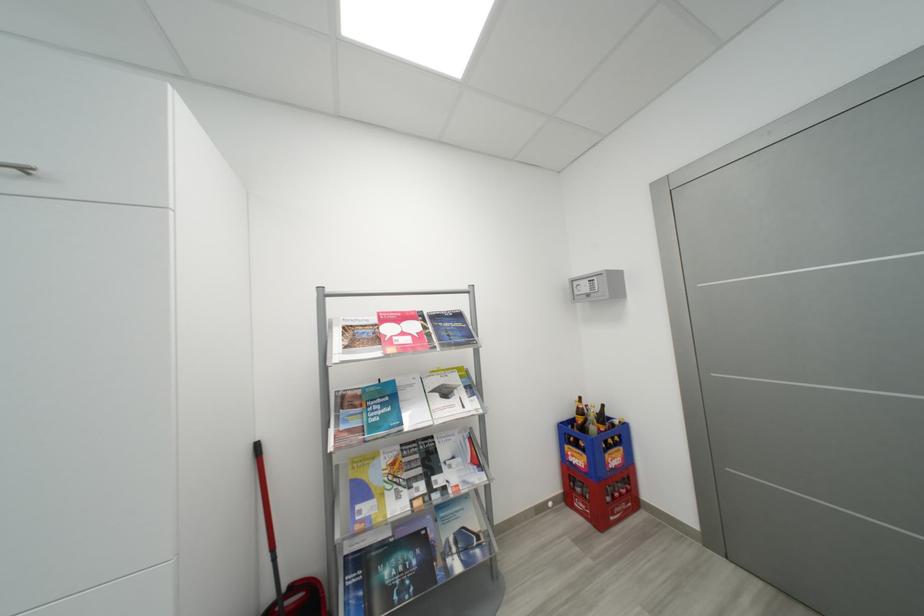
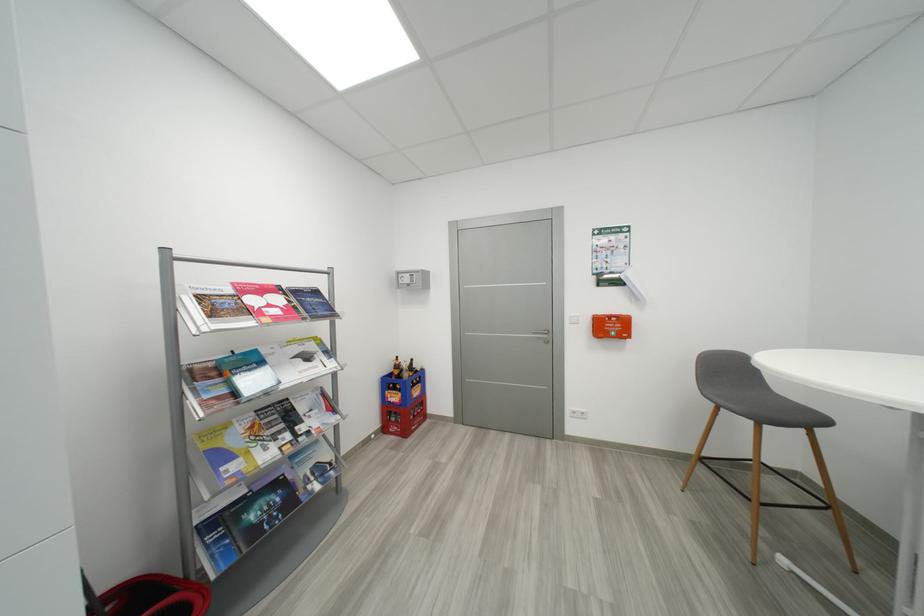
In the second image, find the point that corresponds to (417,339) in the first image.

(286, 310)